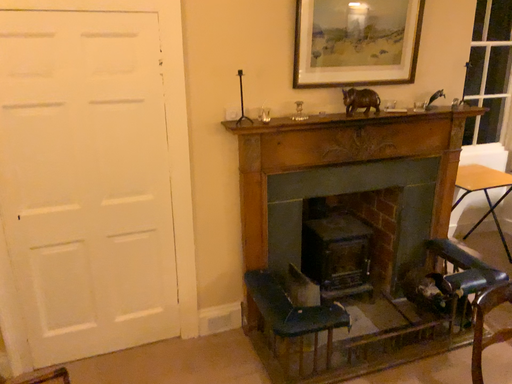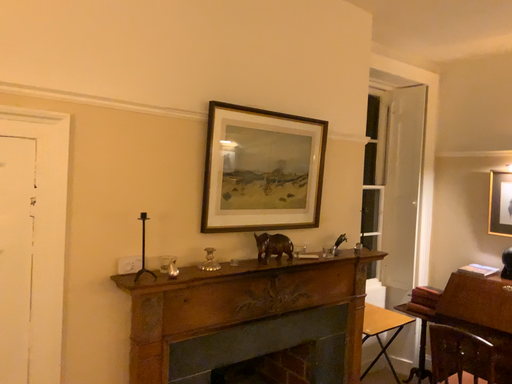
Question: Which way did the camera rotate in the video?

Choices:
 (A) rotated right
 (B) rotated left

Answer: (A)